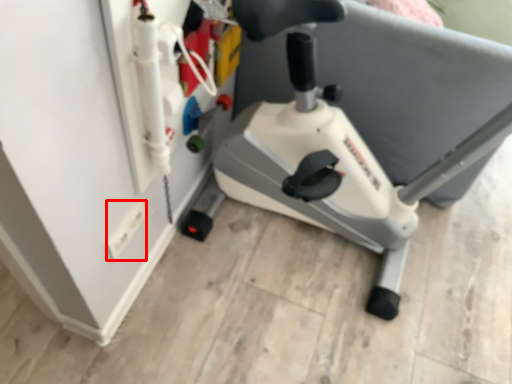
Question: From the image's perspective, where is electric outlet (annotated by the red box) located in relation to stationary bicycle in the image?

Choices:
 (A) below
 (B) above

Answer: (A)